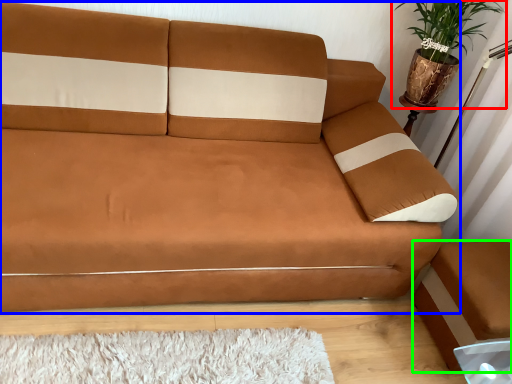
Question: Based on their relative distances, which object is farther from houseplant (highlighted by a red box)? Choose from studio couch (highlighted by a blue box) and footrest (highlighted by a green box).

Choices:
 (A) studio couch
 (B) footrest

Answer: (B)